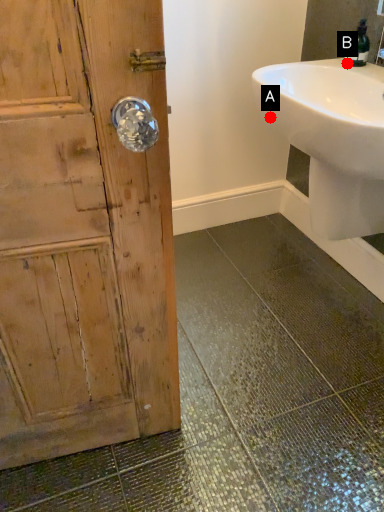
Question: Two points are circled on the image, labeled by A and B beside each circle. Which point is closer to the camera?

Choices:
 (A) A is closer
 (B) B is closer

Answer: (A)